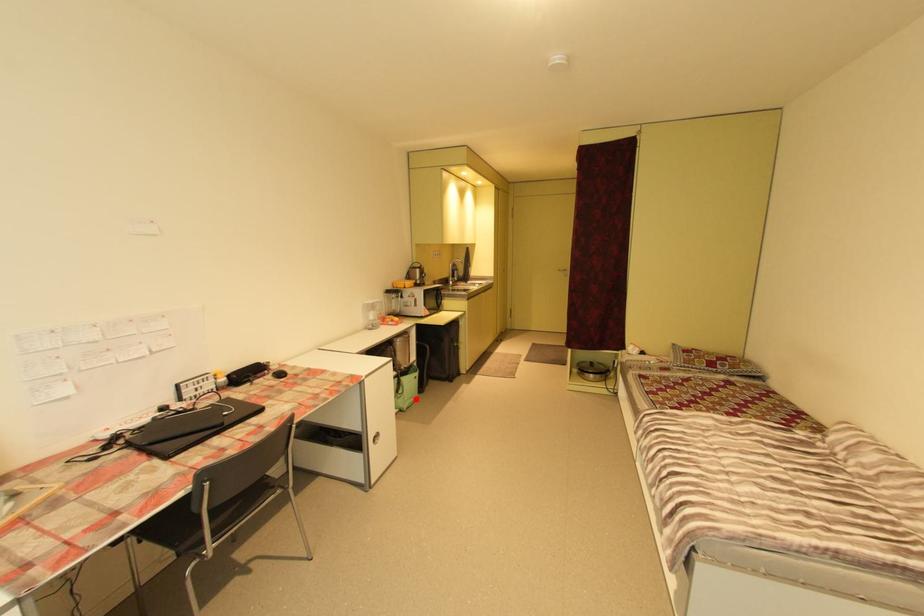
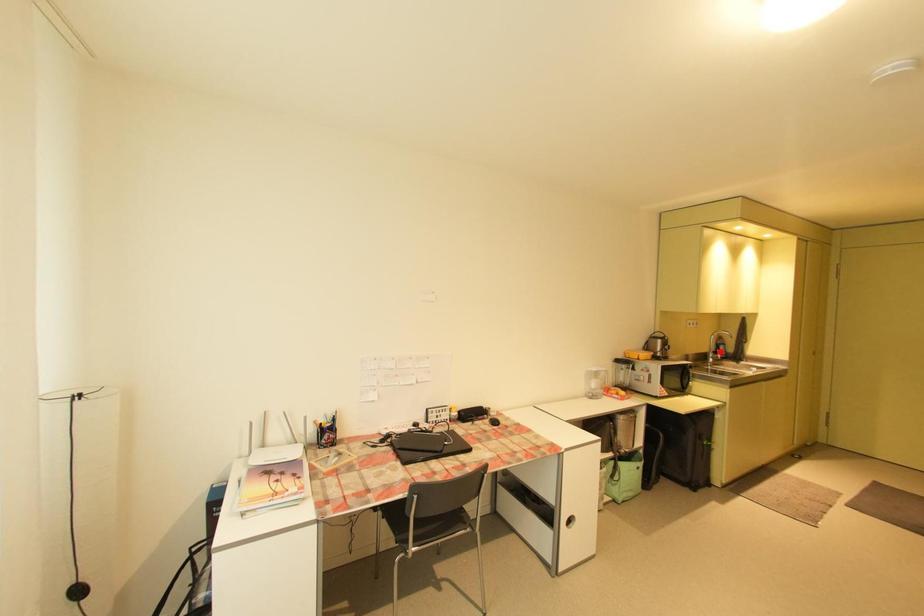
I am providing you with two images of the same scene from different viewpoints. A red point is marked on the first image and another point is marked on the second image. Does the point marked in image1 correspond to the same location as the one in image2?

No